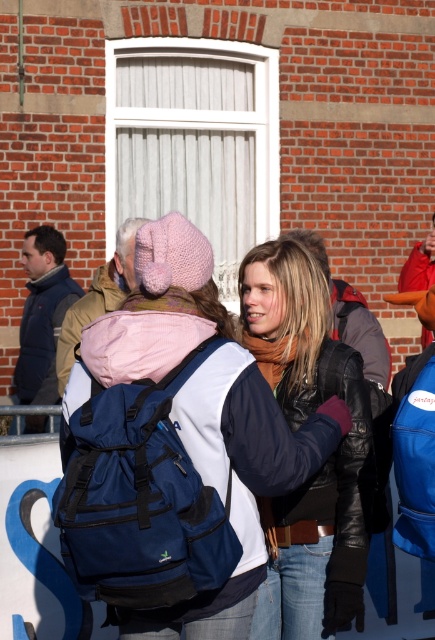
Question: Among these points, which one is nearest to the camera?

Choices:
 (A) coord(60,289)
 (B) coord(291,508)

Answer: (B)

Question: Considering the relative positions of matte black jacket at center and matte black jacket at left in the image provided, where is matte black jacket at center located with respect to matte black jacket at left?

Choices:
 (A) above
 (B) below

Answer: (B)

Question: Considering the relative positions of matte black jacket at center and matte black jacket at left in the image provided, where is matte black jacket at center located with respect to matte black jacket at left?

Choices:
 (A) below
 (B) above

Answer: (A)

Question: Among these objects, which one is nearest to the camera?

Choices:
 (A) matte black jacket at center
 (B) matte black jacket at left

Answer: (A)

Question: Which point is farther to the camera?

Choices:
 (A) (49, 330)
 (B) (355, 556)

Answer: (A)

Question: Can you confirm if matte black jacket at center is positioned above matte black jacket at left?

Choices:
 (A) no
 (B) yes

Answer: (A)